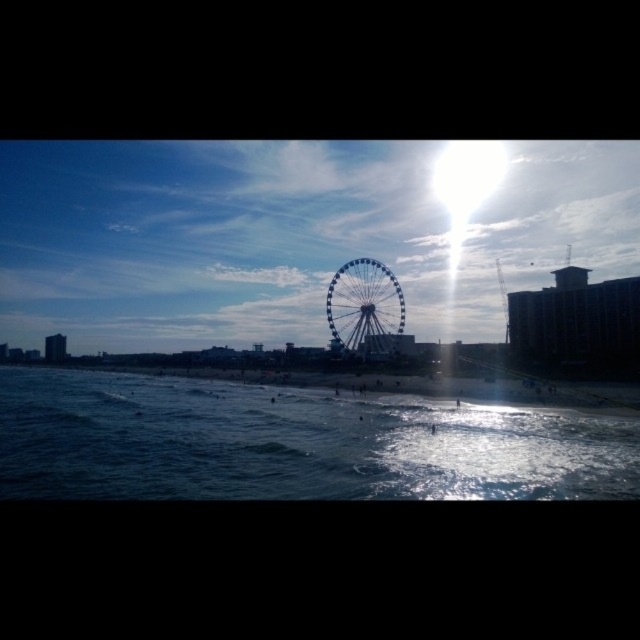
You are standing on the beach and want to take a photo of the silver metallic ferris wheel at center and the dark blue water at lower center. Which object should you point your camera towards first if you want to capture both in one shot?

You should point your camera towards the silver metallic ferris wheel at center first because the dark blue water at lower center is located below it, so framing the ferris wheel higher up will allow the water to be included below in the same shot.

A lifeguard is stationed at point A and needs to reach point B as quickly as possible. The coordinates for point A are point A at (196,497) and point B is at 0.223, 0.692. The beach has a flat sandy terrain. What is the shortest distance the lifeguard should travel to reach point B?

The shortest distance between point A at (196,497) and point B at 0.223, 0.692 is 194.35 meters. The lifeguard should move directly towards point B in a straight line to cover the distance efficiently.

You are standing on the beach and want to take a photo of both the dark blue water at lower center and the silver metallic ferris wheel at center. Which object should you focus on first to ensure both are in sharp focus?

You should focus on the silver metallic ferris wheel at center first because it is farther away from you than the dark blue water at lower center, so adjusting focus from far to near can help both be in sharp focus.